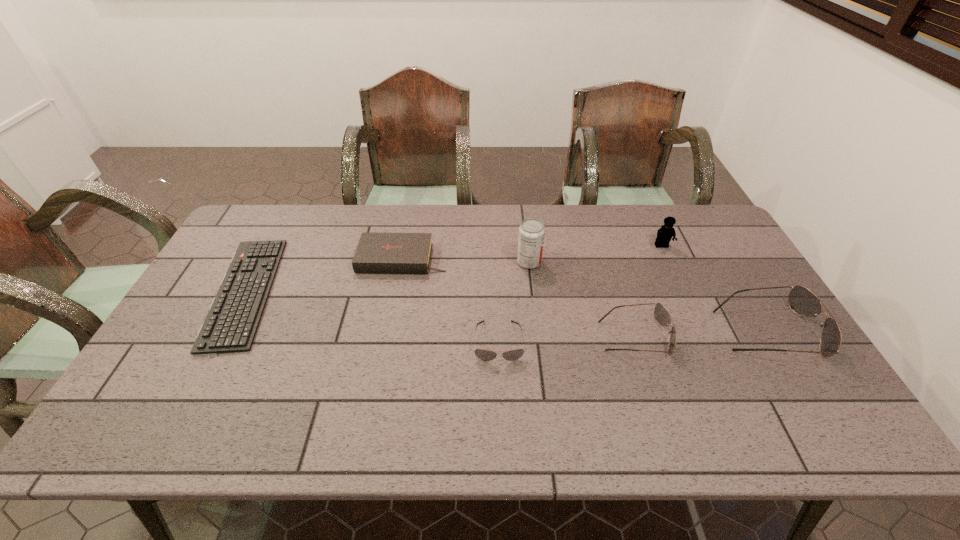
Where is `the second object from right to left`? The height and width of the screenshot is (540, 960). the second object from right to left is located at coordinates (664, 234).

Where is `the sixth shortest object`? the sixth shortest object is located at coordinates (664, 234).

Where is `the sixth object from right to left`? The width and height of the screenshot is (960, 540). the sixth object from right to left is located at coordinates (383, 253).

Locate an element on the screen. The height and width of the screenshot is (540, 960). free space located 0.070m on the front-facing side of the shortest sunglasses is located at coordinates (500, 388).

Where is `vacant space located on the front-facing side of the second tallest sunglasses`? The width and height of the screenshot is (960, 540). vacant space located on the front-facing side of the second tallest sunglasses is located at coordinates (715, 336).

The height and width of the screenshot is (540, 960). In order to click on vacant space located on the back of the computer keyboard in this screenshot , I will do `click(290, 209)`.

In order to click on free region located on the back of the fourth object from left to right in this screenshot , I will do `click(523, 215)`.

Locate an element on the screen. This screenshot has width=960, height=540. free spot located 0.200m on the front-facing side of the sixth shortest object is located at coordinates (684, 295).

Find the location of a particular element. The width and height of the screenshot is (960, 540). free space located on the left of the Bible is located at coordinates (240, 259).

Locate an element on the screen. Image resolution: width=960 pixels, height=540 pixels. computer keyboard at the far edge is located at coordinates (231, 324).